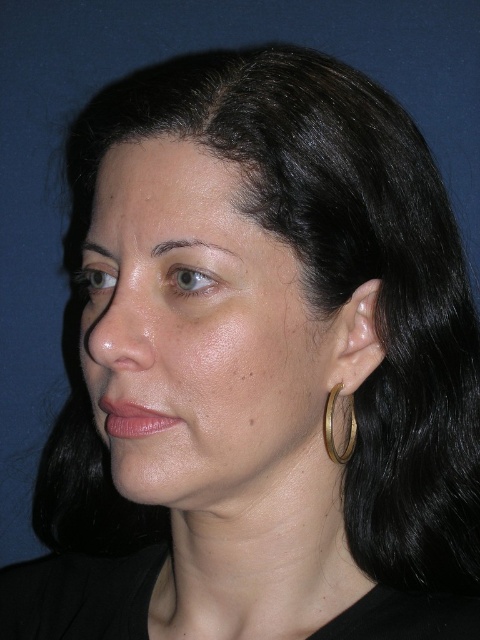
You are a photographer adjusting the lighting for a portrait. You notice the subject has a smooth skin face at center and a gold metallic hoop at ear. Based on the scene description, which object is positioned to the left in the image?

The smooth skin face at center is positioned to the left of the gold metallic hoop at ear according to the description.

Looking at this image, you are a photographer adjusting the lighting for a portrait session. The subject has a smooth skin face at center. You need to place a small reflector at point (201, 340). Will the reflector be placed on the subject or somewhere else?

The reflector will be placed on the subject because at point (201, 340) lies smooth skin face at center.

Based on the scene description, if you were to place a sticker on the smooth skin face at center and the gold metallic hoop at ear, which object would allow for a larger sticker without overlapping onto another object?

The smooth skin face at center has a larger size compared to the gold metallic hoop at ear, so the sticker can be larger on the smooth skin face at center without overlapping.